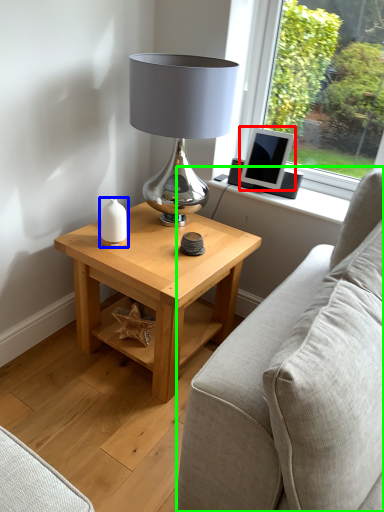
Question: Which object is positioned farthest from computer monitor (highlighted by a red box)? Select from candle holder (highlighted by a blue box) and studio couch (highlighted by a green box).

Choices:
 (A) candle holder
 (B) studio couch

Answer: (B)